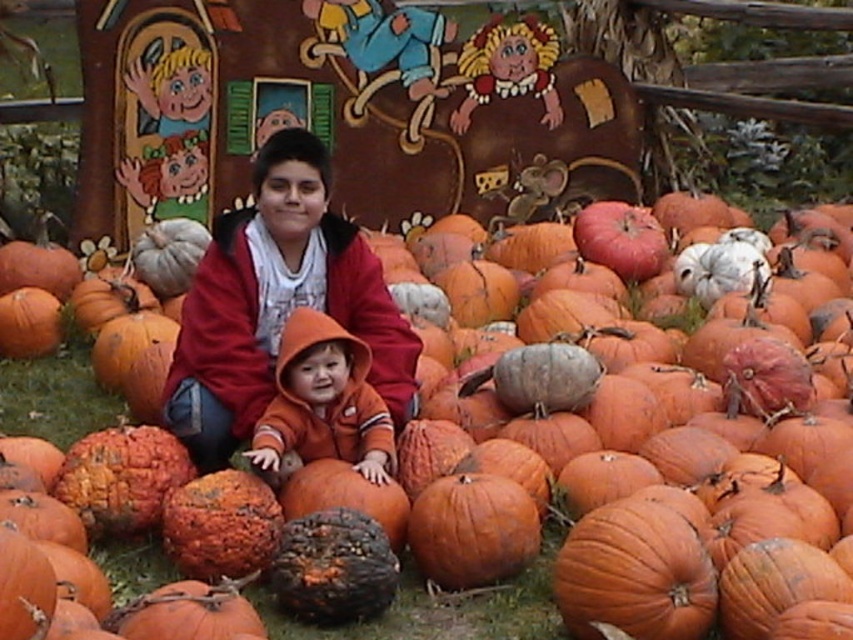
Between point (222, 394) and point (279, 397), which one is positioned in front?

Positioned in front is point (222, 394).

Does matte red hoodie at center lie behind orange fleece hoodie at center?

That is True.

Is point (328, 273) less distant than point (282, 445)?

No, (328, 273) is further to viewer.

Find the location of a particular element. matte red hoodie at center is located at coordinates (277, 301).

Which of these two, matte red hoodie at center or orange matte pumpkin at center, stands taller?

matte red hoodie at center

How far apart are matte red hoodie at center and orange matte pumpkin at center?

matte red hoodie at center and orange matte pumpkin at center are 4.35 feet apart.

Is point (229, 429) positioned in front of point (537, 604)?

No, (229, 429) is further to viewer.

Locate an element on the screen. matte red hoodie at center is located at coordinates coord(277,301).

This screenshot has height=640, width=853. What do you see at coordinates (450, 611) in the screenshot?
I see `orange matte pumpkin at center` at bounding box center [450, 611].

Who is more distant from viewer, (x=387, y=636) or (x=323, y=396)?

Point (x=323, y=396)

Find the location of a particular element. Image resolution: width=853 pixels, height=640 pixels. orange matte pumpkin at center is located at coordinates (450, 611).